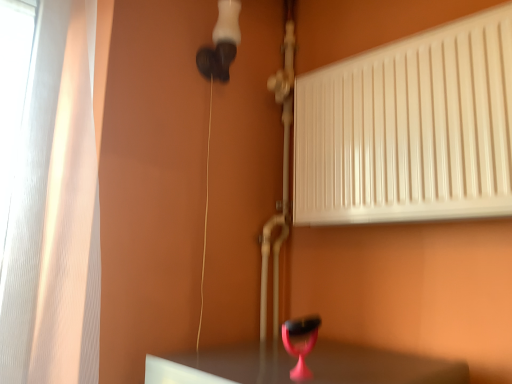
Question: Which is correct: white glossy radiator at upper right is inside pink plastic table lamp at lower center, or outside of it?

Choices:
 (A) inside
 (B) outside

Answer: (B)

Question: In the image, is white glossy radiator at upper right on the left side or the right side of pink plastic table lamp at lower center?

Choices:
 (A) left
 (B) right

Answer: (B)

Question: Considering the positions of white glossy radiator at upper right and pink plastic table lamp at lower center in the image, is white glossy radiator at upper right wider or thinner than pink plastic table lamp at lower center?

Choices:
 (A) wide
 (B) thin

Answer: (A)

Question: Considering the positions of pink plastic table lamp at lower center and white glossy radiator at upper right in the image, is pink plastic table lamp at lower center bigger or smaller than white glossy radiator at upper right?

Choices:
 (A) big
 (B) small

Answer: (B)

Question: From the image's perspective, is pink plastic table lamp at lower center located above or below white glossy radiator at upper right?

Choices:
 (A) above
 (B) below

Answer: (B)

Question: From a real-world perspective, is pink plastic table lamp at lower center physically located above or below white glossy radiator at upper right?

Choices:
 (A) below
 (B) above

Answer: (A)

Question: Looking at their shapes, would you say pink plastic table lamp at lower center is wider or thinner than white glossy radiator at upper right?

Choices:
 (A) thin
 (B) wide

Answer: (A)